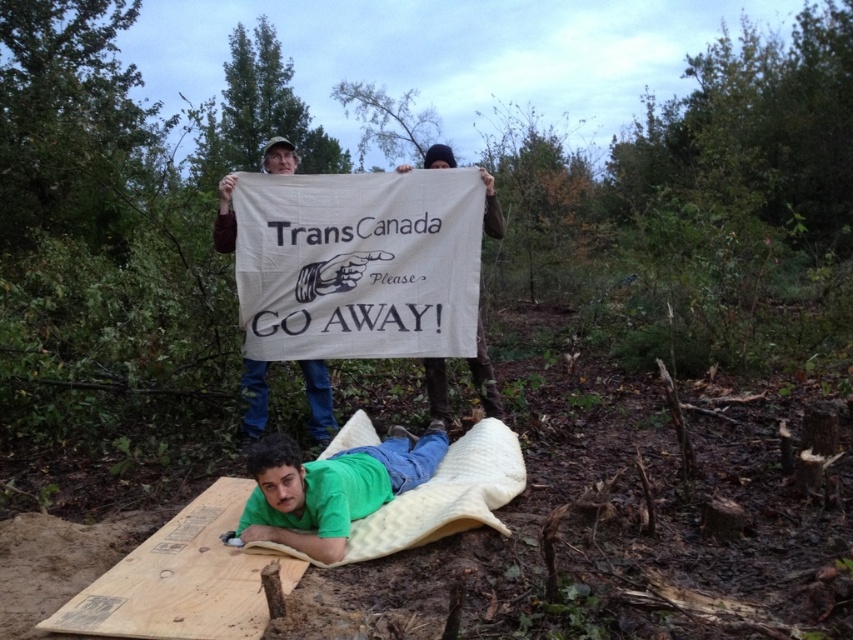
Question: Which point is closer to the camera?

Choices:
 (A) green fabric at lower center
 (B) white fabric banner at center

Answer: (A)

Question: Can you confirm if wooden plank at lower left is bigger than white fabric banner at center?

Choices:
 (A) no
 (B) yes

Answer: (A)

Question: Does wooden plank at lower left appear under white fabric banner at center?

Choices:
 (A) yes
 (B) no

Answer: (A)

Question: Which point is farther to the camera?

Choices:
 (A) white fabric banner at center
 (B) brown cotton shirt at upper center
 (C) wooden plank at lower left
 (D) green fabric at lower center

Answer: (B)

Question: From the image, what is the correct spatial relationship of green fabric at lower center in relation to brown cotton shirt at upper center?

Choices:
 (A) right
 (B) left

Answer: (A)

Question: Which point is closer to the camera taking this photo?

Choices:
 (A) (485, 356)
 (B) (326, 381)

Answer: (A)